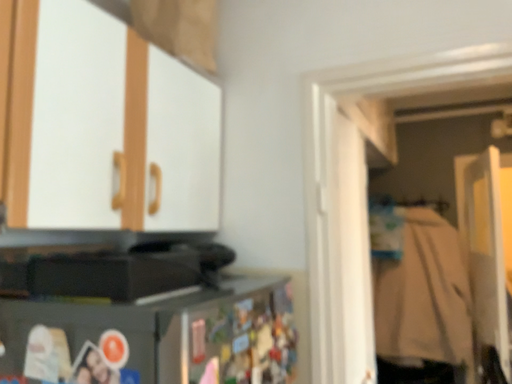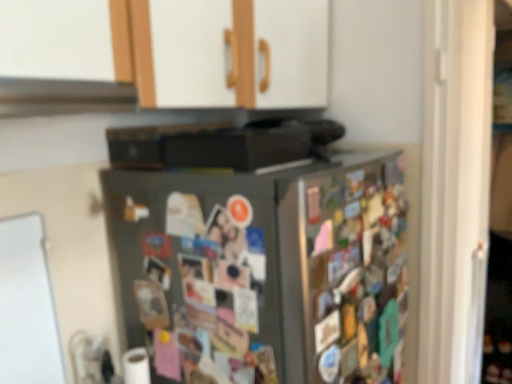
Question: Which way did the camera rotate in the video?

Choices:
 (A) rotated downward
 (B) rotated upward

Answer: (A)